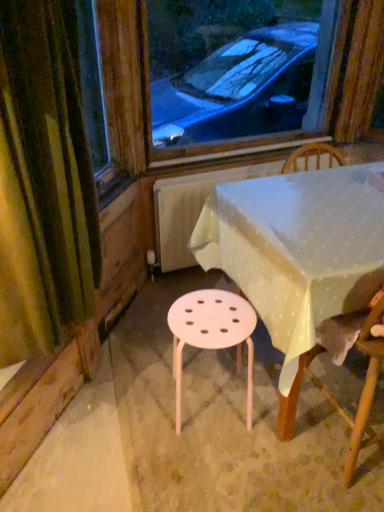
Question: Choose the correct answer: Is green fabric curtain at left inside white plastic table at center or outside it?

Choices:
 (A) outside
 (B) inside

Answer: (A)

Question: Does point (16, 4) appear closer or farther from the camera than point (256, 284)?

Choices:
 (A) farther
 (B) closer

Answer: (B)

Question: Which is nearer to the green fabric curtain at left?

Choices:
 (A) pink plastic stool at center
 (B) wooden chair at lower right
 (C) white plastic table at center

Answer: (A)

Question: Which of these objects is positioned farthest from the white plastic table at center?

Choices:
 (A) wooden chair at lower right
 (B) green fabric curtain at left
 (C) pink plastic stool at center

Answer: (B)